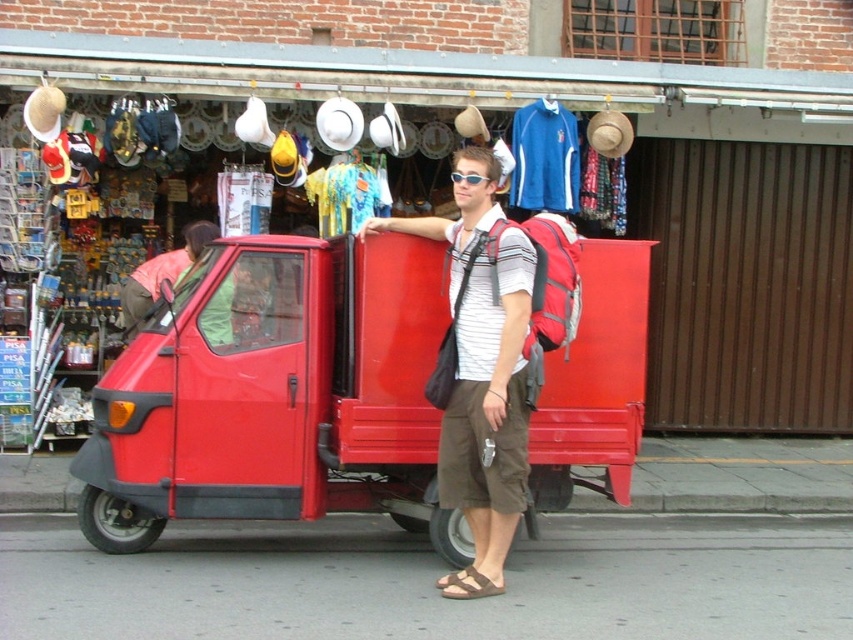
Between matte red scooter at center and sunglasses at center, which one has more height?

matte red scooter at center is taller.

This screenshot has height=640, width=853. I want to click on matte red scooter at center, so click(x=480, y=372).

Is point (474, 355) positioned in front of point (454, 180)?

That is True.

Where is `matte red scooter at center`? This screenshot has width=853, height=640. matte red scooter at center is located at coordinates (480, 372).

Can you confirm if red matte/metallic food truck at center is positioned above sunglasses at center?

No.

Can you confirm if red matte/metallic food truck at center is positioned to the right of sunglasses at center?

In fact, red matte/metallic food truck at center is to the left of sunglasses at center.

What do you see at coordinates (276, 394) in the screenshot? Image resolution: width=853 pixels, height=640 pixels. I see `red matte/metallic food truck at center` at bounding box center [276, 394].

Locate an element on the screen. red matte/metallic food truck at center is located at coordinates (276, 394).

Based on the photo, is red matte/metallic food truck at center closer to the viewer compared to matte green shirt at center?

Yes, it is in front of matte green shirt at center.

Identify the location of red matte/metallic food truck at center. (276, 394).

Find the location of a particular element. red matte/metallic food truck at center is located at coordinates tap(276, 394).